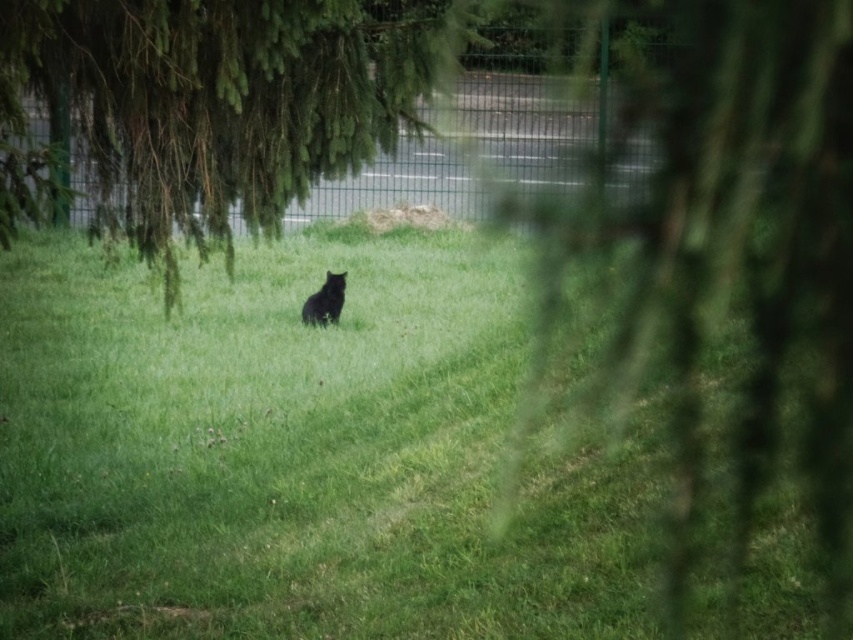
Is the position of green grassy at center less distant than that of green textured tree at upper left?

No, it is behind green textured tree at upper left.

Can you confirm if green grassy at center is shorter than green textured tree at upper left?

In fact, green grassy at center may be taller than green textured tree at upper left.

Who is more forward, (432, 449) or (415, 19)?

Positioned in front is point (432, 449).

Find the location of a particular element. This screenshot has height=640, width=853. green grassy at center is located at coordinates (299, 452).

Who is shorter, green grassy at center or black fur cat at center?

black fur cat at center

Is point (260, 540) farther from viewer compared to point (341, 280)?

No, (260, 540) is in front of (341, 280).

The height and width of the screenshot is (640, 853). In order to click on green grassy at center in this screenshot , I will do click(x=299, y=452).

In the scene shown: Who is positioned more to the left, green textured tree at upper left or black fur cat at center?

Positioned to the left is black fur cat at center.

Is point (376, 72) positioned behind point (309, 321)?

No, it is not.

Identify the location of green textured tree at upper left. coord(212,106).